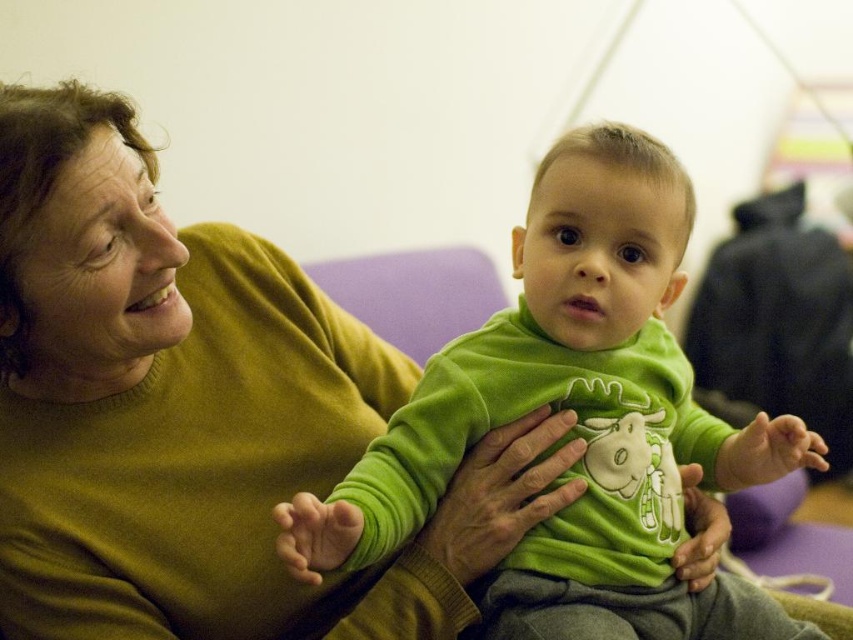
Question: Which of the following is the closest to the observer?

Choices:
 (A) green velvety shirt at center
 (B) matte green sweater at center

Answer: (A)

Question: Considering the relative positions of matte green sweater at center and green velvety shirt at center in the image provided, where is matte green sweater at center located with respect to green velvety shirt at center?

Choices:
 (A) right
 (B) left

Answer: (B)

Question: Is matte green sweater at center to the left of green velvety shirt at center from the viewer's perspective?

Choices:
 (A) no
 (B) yes

Answer: (B)

Question: Which object appears farthest from the camera in this image?

Choices:
 (A) green velvety shirt at center
 (B) matte green sweater at center

Answer: (B)

Question: In this image, where is matte green sweater at center located relative to green velvety shirt at center?

Choices:
 (A) right
 (B) left

Answer: (B)